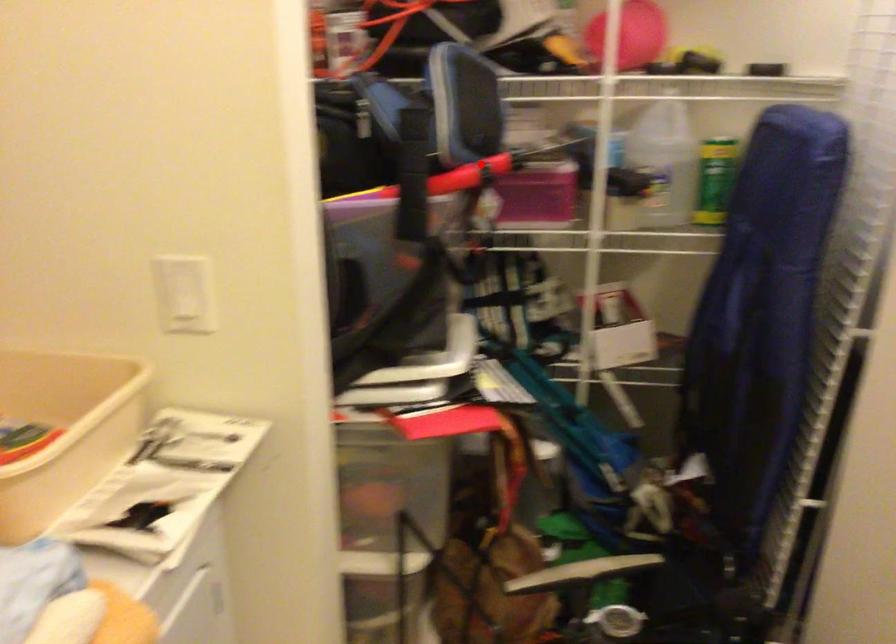
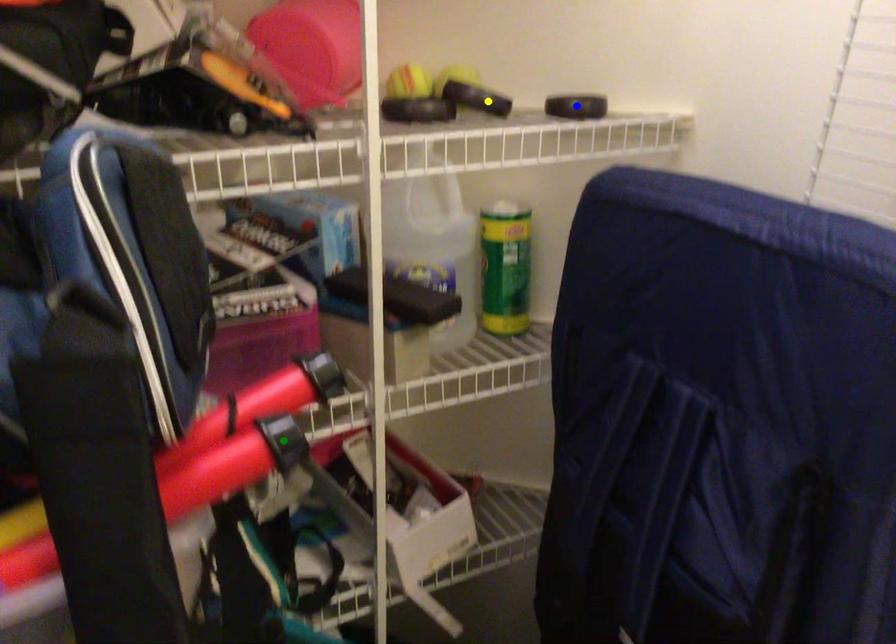
Question: I am providing you with two images of the same scene from different viewpoints. A red point is marked on the first image. You are given multiple points on the second image. Which spot in image 2 lines up with the point in image 1?

Choices:
 (A) green point
 (B) yellow point
 (C) blue point

Answer: (A)